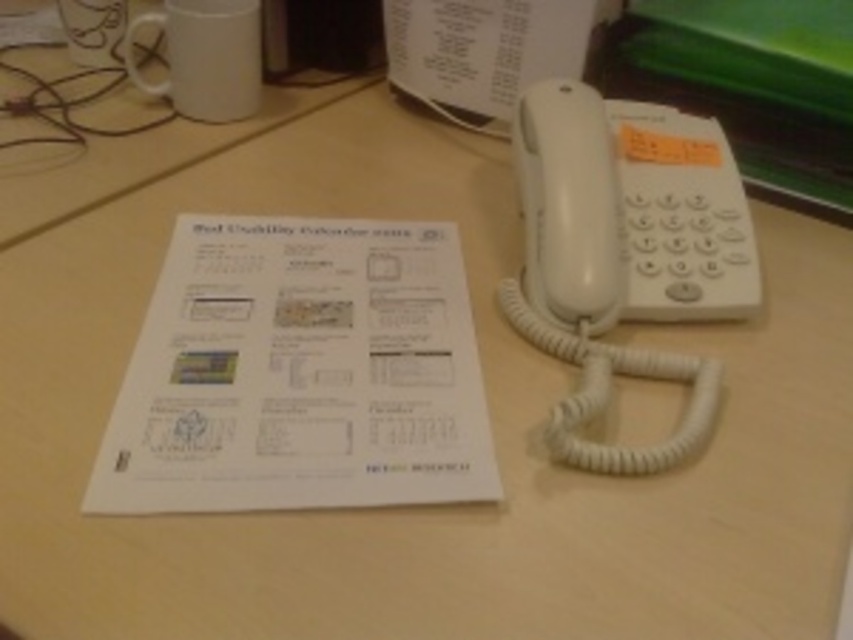
Question: Which of the following is the farthest from the observer?

Choices:
 (A) white plastic phone at right
 (B) white paper at center

Answer: (A)

Question: Which point is farther from the camera taking this photo?

Choices:
 (A) (596, 109)
 (B) (399, 378)

Answer: (A)

Question: Does white paper at center appear under white plastic phone at right?

Choices:
 (A) yes
 (B) no

Answer: (A)

Question: Is the position of white paper at center more distant than that of white plastic phone at right?

Choices:
 (A) yes
 (B) no

Answer: (B)

Question: Which object appears farthest from the camera in this image?

Choices:
 (A) white paper at center
 (B) white plastic phone at right

Answer: (B)

Question: Is white paper at center thinner than white plastic phone at right?

Choices:
 (A) yes
 (B) no

Answer: (B)